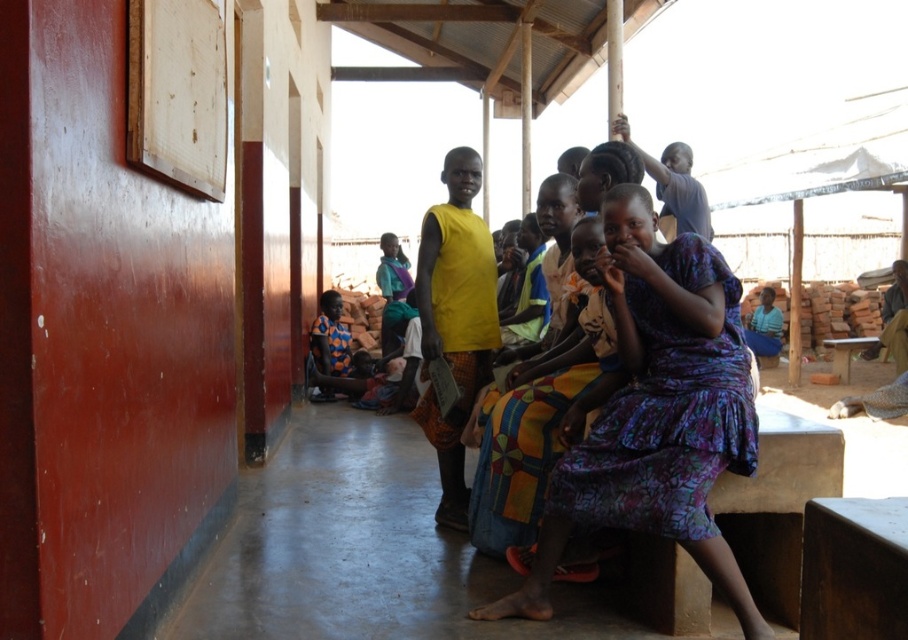
Question: From the image, what is the correct spatial relationship of purple floral dress at center in relation to yellow fabric dress at center?

Choices:
 (A) right
 (B) left

Answer: (A)

Question: Does purple floral dress at center have a greater width compared to yellow fabric dress at center?

Choices:
 (A) no
 (B) yes

Answer: (B)

Question: Among these points, which one is farthest from the camera?

Choices:
 (A) (706, 388)
 (B) (346, 380)

Answer: (B)

Question: Can you confirm if purple floral dress at center is thinner than yellow fabric dress at center?

Choices:
 (A) yes
 (B) no

Answer: (B)

Question: Considering the real-world distances, which object is closest to the purple floral dress at center?

Choices:
 (A) printed fabric baby carrier at center
 (B) yellow fabric dress at center

Answer: (B)

Question: Which object is farther from the camera taking this photo?

Choices:
 (A) printed fabric baby carrier at center
 (B) yellow fabric dress at center
 (C) purple floral dress at center

Answer: (A)